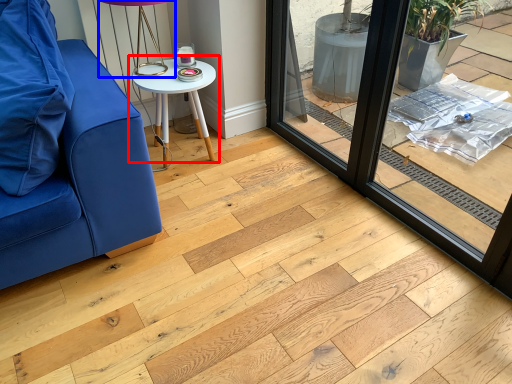
Question: Which object appears farthest to the camera in this image, table (highlighted by a red box) or table lamp (highlighted by a blue box)?

Choices:
 (A) table
 (B) table lamp

Answer: (A)